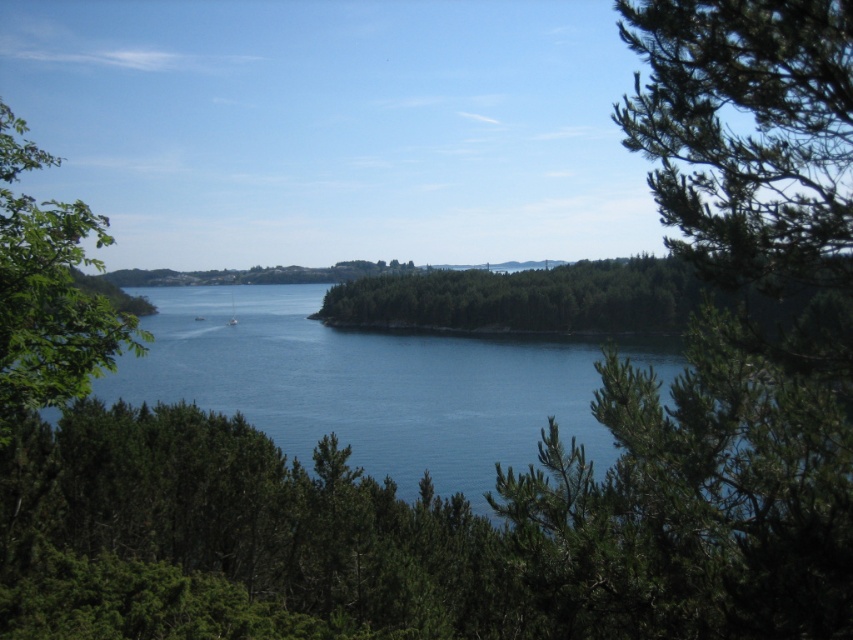
Question: Can you confirm if blue water at center is bigger than green leafy tree at left?

Choices:
 (A) yes
 (B) no

Answer: (B)

Question: Which object appears farthest from the camera in this image?

Choices:
 (A) green needle-like leaves at upper right
 (B) green leafy tree at left

Answer: (A)

Question: Does green needle-like leaves at upper right have a smaller size compared to green leafy tree at left?

Choices:
 (A) no
 (B) yes

Answer: (B)

Question: Is green needle-like leaves at upper right above green leafy forest at center?

Choices:
 (A) yes
 (B) no

Answer: (A)

Question: Among these objects, which one is farthest from the camera?

Choices:
 (A) green leafy tree at left
 (B) green leafy forest at center
 (C) blue water at center

Answer: (B)

Question: Which point is farther to the camera?

Choices:
 (A) green needle-like leaves at upper right
 (B) blue water at center
 (C) green leafy forest at center
 (D) green leafy tree at left

Answer: (C)